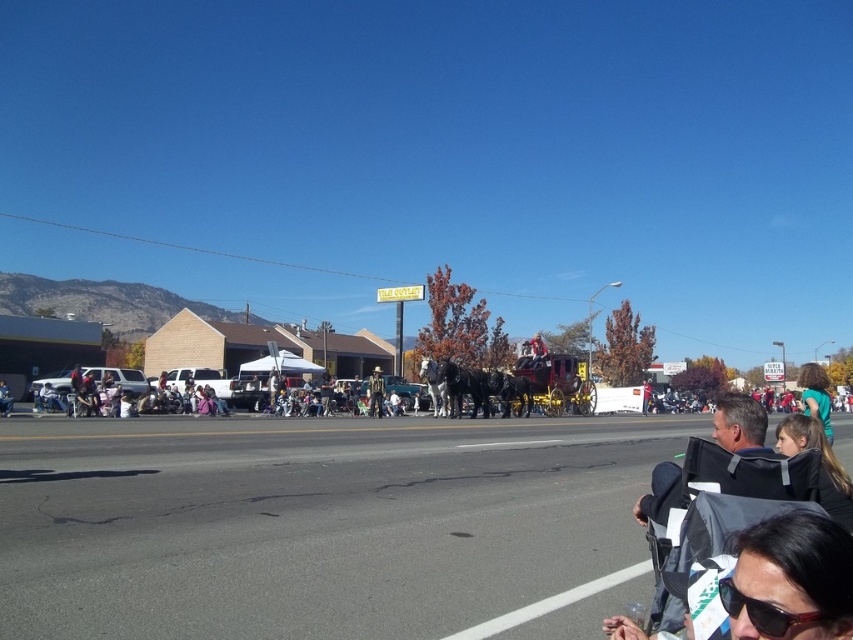
Does green matte shirt at center have a greater width compared to wooden cowboy hat at center?

Yes, green matte shirt at center is wider than wooden cowboy hat at center.

I want to click on green matte shirt at center, so click(x=815, y=396).

Measure the distance between black plastic bag at lower right and wooden cowboy hat at center.

black plastic bag at lower right is 101.82 feet away from wooden cowboy hat at center.

Is black plastic bag at lower right above wooden cowboy hat at center?

Correct, black plastic bag at lower right is located above wooden cowboy hat at center.

Identify the location of black plastic bag at lower right. The image size is (853, 640). (791, 580).

Locate an element on the screen. black plastic bag at lower right is located at coordinates (791, 580).

Who is lower down, black plastic bag at lower right or green matte shirt at center?

green matte shirt at center is below.

From the picture: Who is more distant from viewer, [819,531] or [805,412]?

Positioned behind is point [805,412].

At what (x,y) coordinates should I click in order to perform the action: click on black plastic bag at lower right. Please return your answer as a coordinate pair (x, y). Looking at the image, I should click on (791, 580).

Where is `black plastic bag at lower right`? This screenshot has width=853, height=640. black plastic bag at lower right is located at coordinates tap(791, 580).